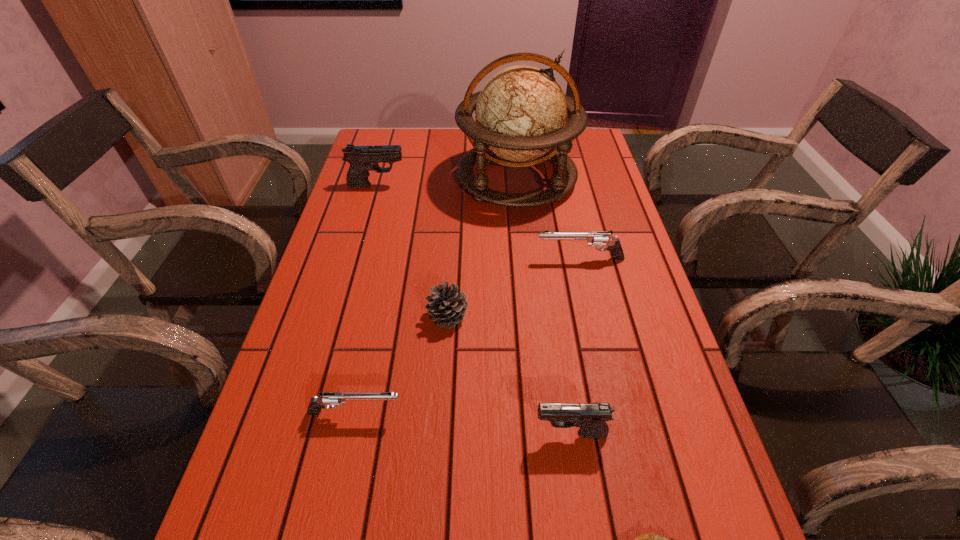
Where is `free space located on the front of the tallest object`? This screenshot has height=540, width=960. free space located on the front of the tallest object is located at coordinates (530, 313).

Where is `blank area located at the barrel of the farthest pistol`? blank area located at the barrel of the farthest pistol is located at coordinates (487, 185).

Find the location of a particular element. blank space located 0.400m at the barrel of the nearer black pistol is located at coordinates (315, 434).

You are a GUI agent. You are given a task and a screenshot of the screen. Output one action in this format:
    pyautogui.click(x=<x>, y=<y>)
    Task: Click on the vacant space located 0.110m at the barrel of the nearer black pistol
    This screenshot has height=540, width=960.
    Given the screenshot: What is the action you would take?
    pyautogui.click(x=474, y=434)

Where is `vacant space located 0.150m at the barrel of the nearer black pistol`? The height and width of the screenshot is (540, 960). vacant space located 0.150m at the barrel of the nearer black pistol is located at coordinates (452, 434).

The height and width of the screenshot is (540, 960). Find the location of `vacant point located 0.210m on the back of the fourth nearest object`. vacant point located 0.210m on the back of the fourth nearest object is located at coordinates (453, 241).

At what (x,y) coordinates should I click in order to perform the action: click on free space located 0.160m on the front-facing side of the right silver pistol. Please return your answer as a coordinate pair (x, y). This screenshot has width=960, height=540. Looking at the image, I should click on (473, 259).

Identify the location of vacant area situated 0.190m on the front-facing side of the right silver pistol. (462, 259).

What are the coordinates of `vacant space located 0.270m on the front-facing side of the right silver pistol` in the screenshot? It's located at click(430, 259).

This screenshot has width=960, height=540. Identify the location of free space located 0.370m on the front-facing side of the shortest pistol. (598, 413).